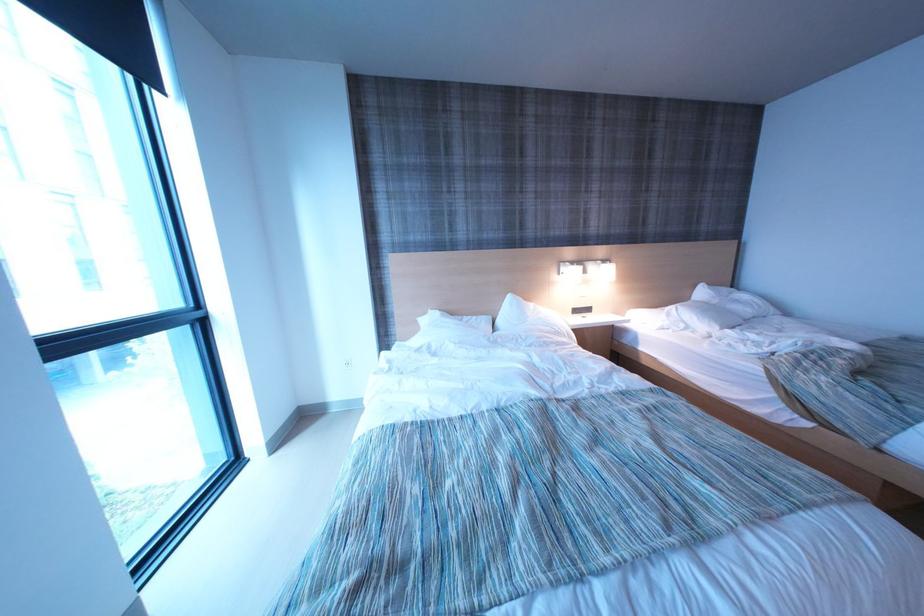
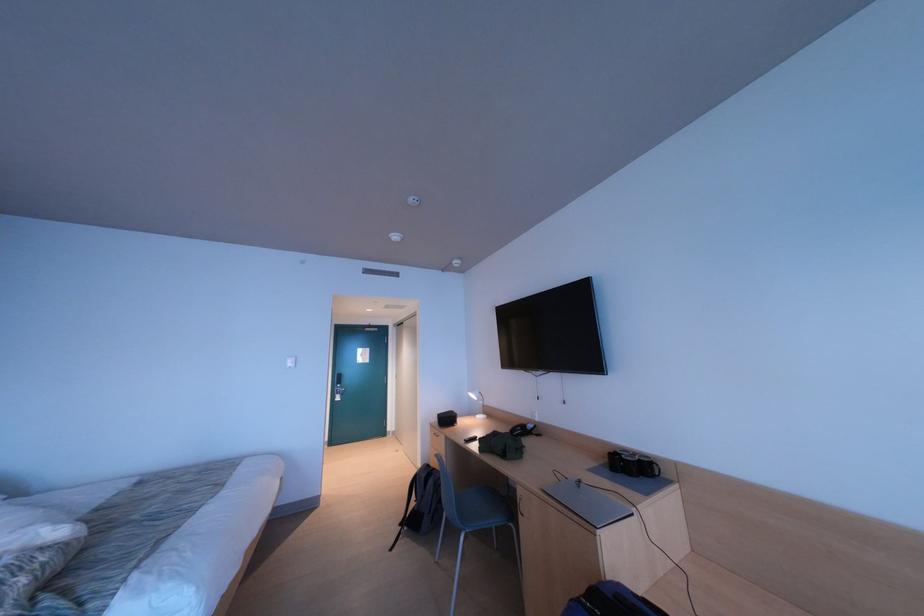
Question: Based on the continuous images, in which direction is the camera rotating? Reply with the corresponding letter.

Choices:
 (A) Left
 (B) Right
 (C) Up
 (D) Down

Answer: (B)